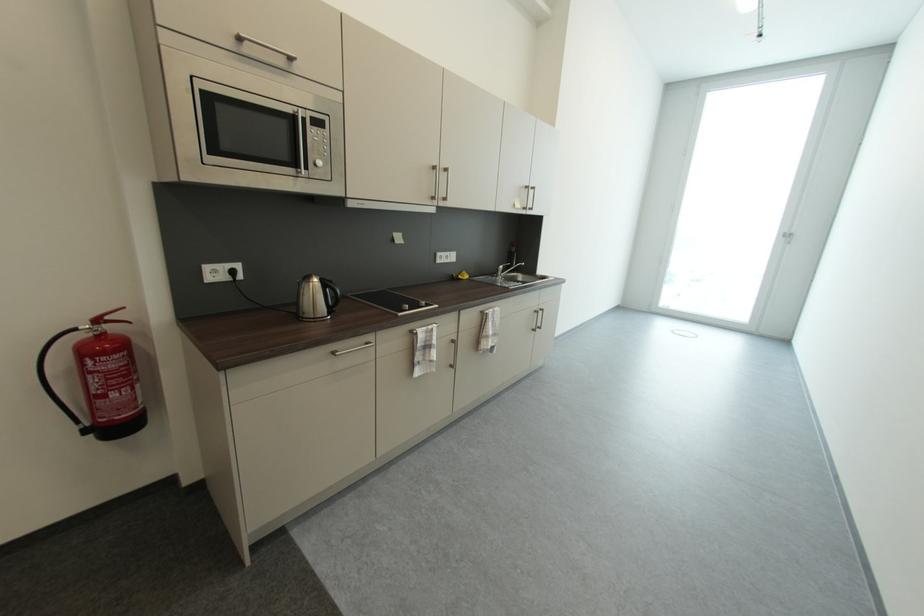
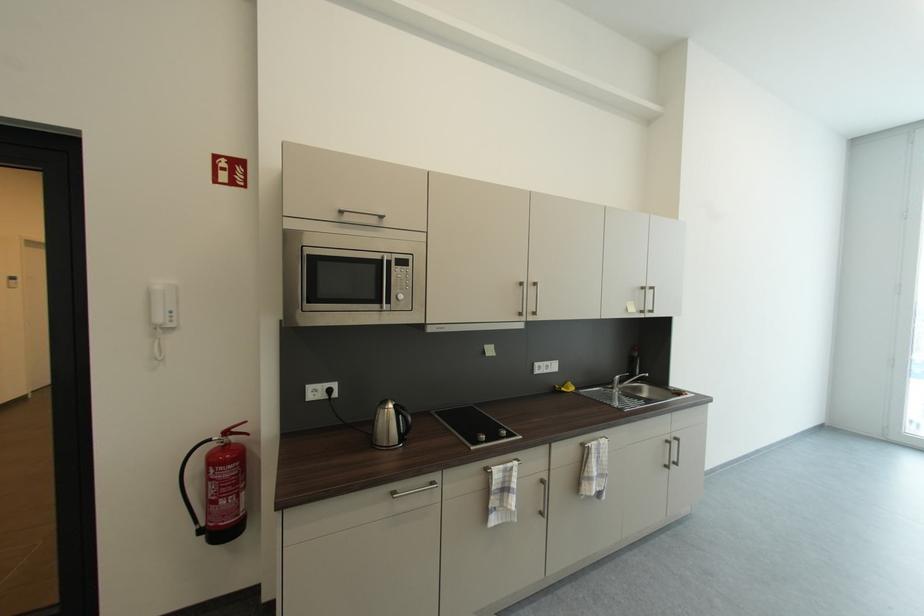
The point at [81,431] is marked in the first image. Where is the corresponding point in the second image?

(199, 531)